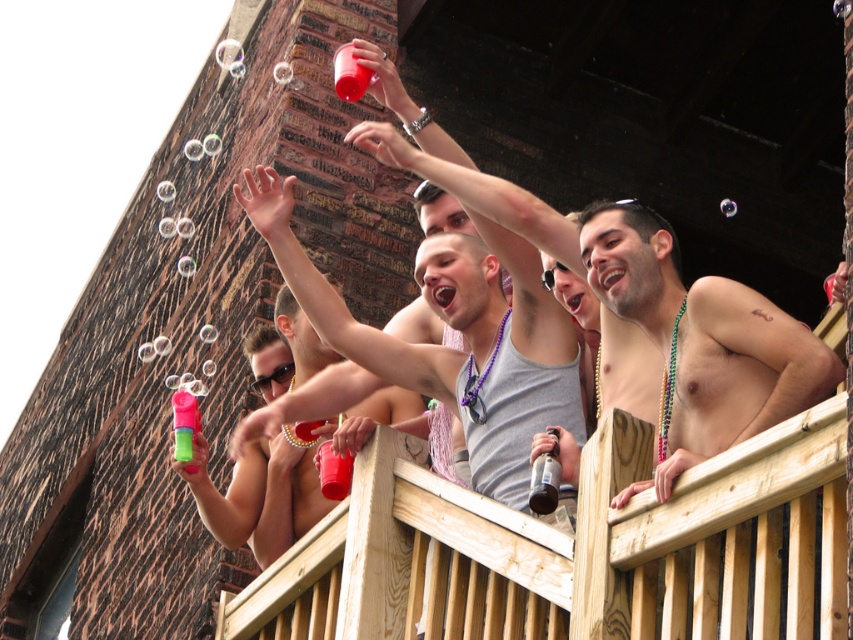
Question: Is gray matte tank top at center below translucent plastic bottle at center?

Choices:
 (A) yes
 (B) no

Answer: (B)

Question: Which point appears closest to the camera in this image?

Choices:
 (A) (634, 481)
 (B) (268, 237)
 (C) (181, 396)

Answer: (A)

Question: Among these objects, which one is nearest to the camera?

Choices:
 (A) translucent plastic bottle at center
 (B) pink plastic bottle at upper center
 (C) gray matte tank top at center

Answer: (A)

Question: Is gray matte tank top at center below translucent plastic bottle at center?

Choices:
 (A) yes
 (B) no

Answer: (B)

Question: Is shiny metallic can at center smaller than shiny skin at upper right?

Choices:
 (A) yes
 (B) no

Answer: (B)

Question: Among these objects, which one is nearest to the camera?

Choices:
 (A) shiny metallic can at center
 (B) pink plastic bottle at upper center

Answer: (A)